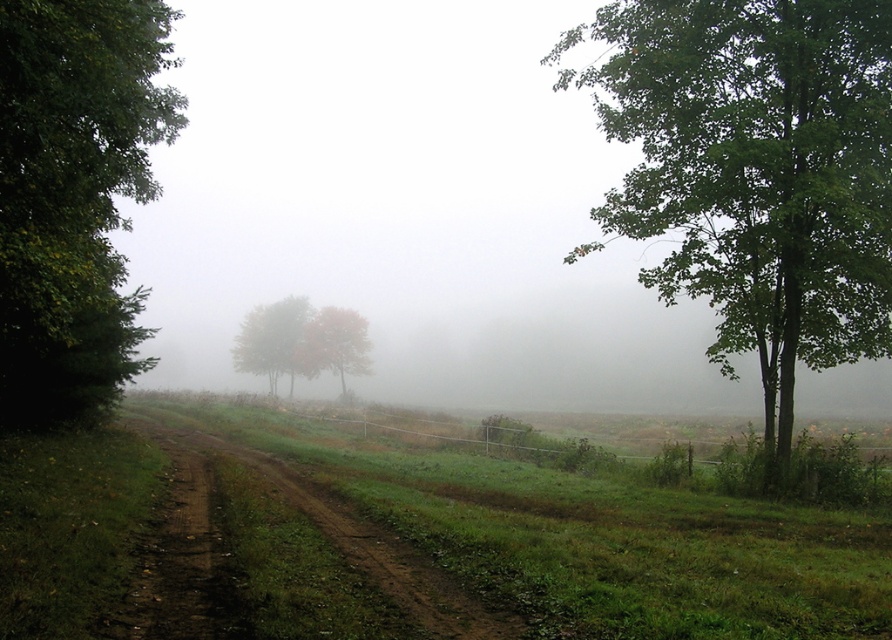
You are a bird looking for a nesting spot. You see the green leafy tree at left and the orange leafy tree at center. Which tree would you choose if you prefer nesting in taller trees?

The green leafy tree at left is much taller than the orange leafy tree at center, so the bird would choose the green leafy tree at left for nesting.

You are a hiker who wants to walk along the brown dirt track at center. There is an autumn leaves tree at center in the background. Which object would you encounter first as you start walking forward?

The brown dirt track at center is closer to the viewer than the autumn leaves tree at center, so you would encounter the brown dirt track at center first before reaching the autumn leaves tree at center.

You are a hiker trying to follow the dirt path in the misty forest. You see the brown dirt track at center and the autumn leaves tree at center. Which direction should you head to stay on the path?

You should head to the right of the autumn leaves tree at center because the brown dirt track at center is located to the right of it.